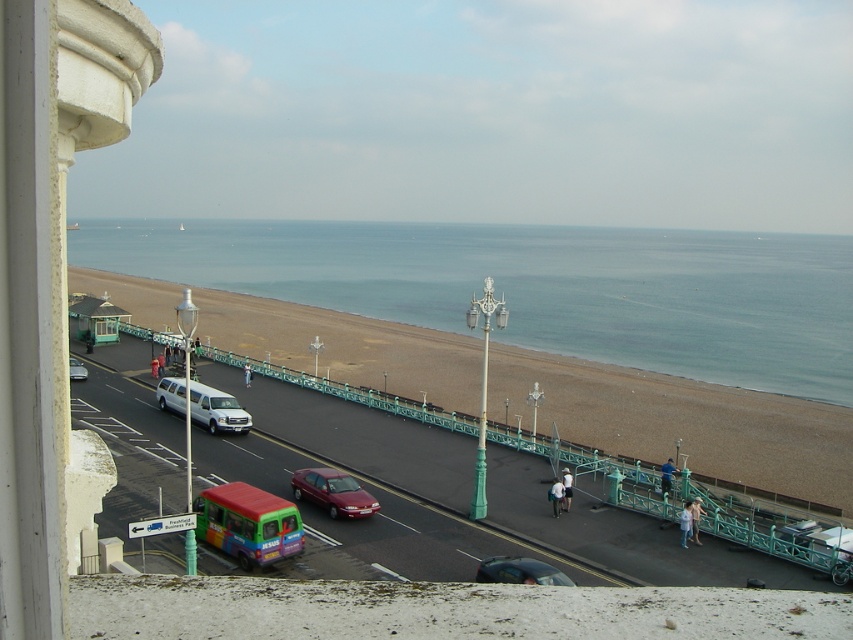
You are a photographer standing on the seaside promenade. You want to capture a photo of the brown sand at lower center and the shiny red sedan at center. Which object appears closer to the camera in the photo?

The brown sand at lower center appears closer to the camera because it is much taller than the shiny red sedan at center, indicating it occupies more of the foreground in the image.